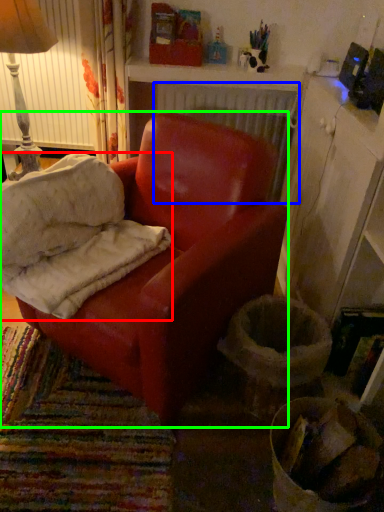
Question: Based on their relative distances, which object is farther from material (highlighted by a red box)? Choose from radiator (highlighted by a blue box) and chair (highlighted by a green box).

Choices:
 (A) radiator
 (B) chair

Answer: (A)